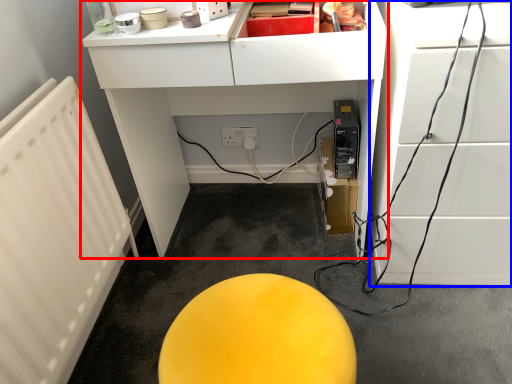
Question: Which point is closer to the camera, furniture (highlighted by a red box) or furniture (highlighted by a blue box)?

Choices:
 (A) furniture
 (B) furniture

Answer: (B)